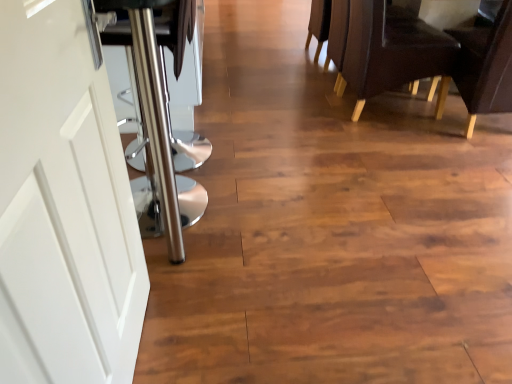
Locate an element on the screen. This screenshot has height=384, width=512. vacant space situated on the left part of brown leather chair at upper right, marked as the 1th chair in a right-to-left arrangement is located at coordinates (411, 140).